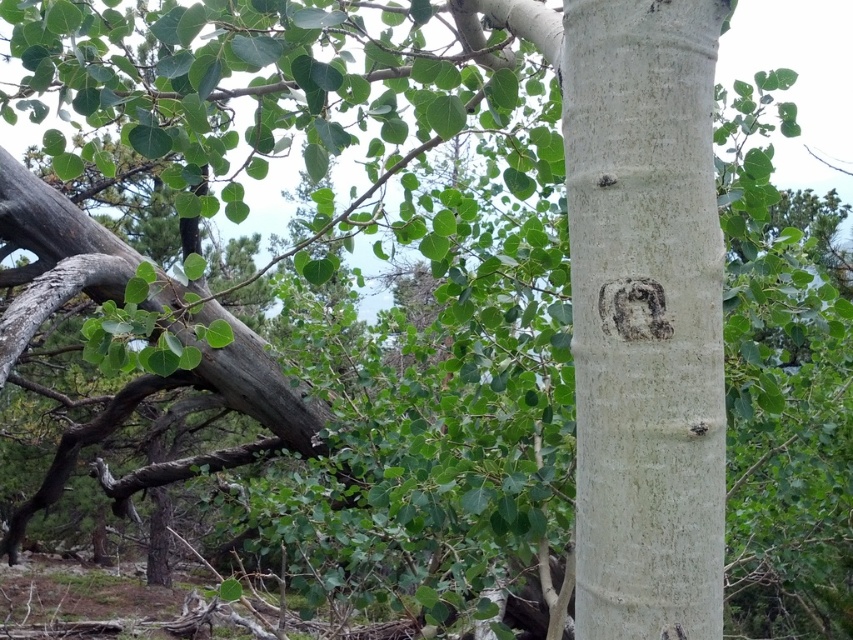
Does white smooth tree trunk at center have a smaller size compared to smooth gray stone face at center?

No.

Image resolution: width=853 pixels, height=640 pixels. Describe the element at coordinates (665, 316) in the screenshot. I see `white smooth tree trunk at center` at that location.

Is point (706, 68) positioned after point (605, 317)?

Yes, point (706, 68) is behind point (605, 317).

In order to click on white smooth tree trunk at center in this screenshot , I will do `click(665, 316)`.